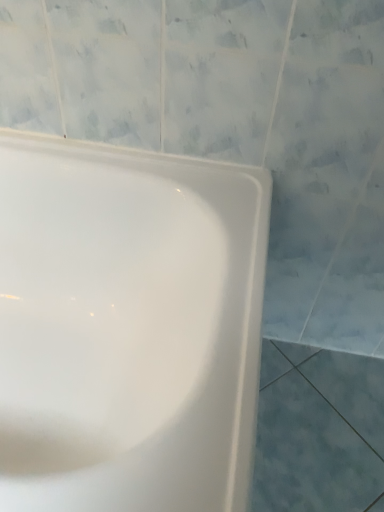
Question: Should I look upward or downward to see white glossy bathtub at upper left?

Choices:
 (A) up
 (B) down

Answer: (B)